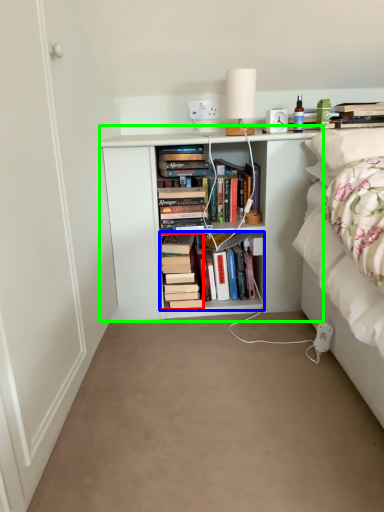
Question: Estimate the real-world distances between objects in this image. Which object is closer to book (highlighted by a red box), book (highlighted by a blue box) or shelf (highlighted by a green box)?

Choices:
 (A) book
 (B) shelf

Answer: (A)